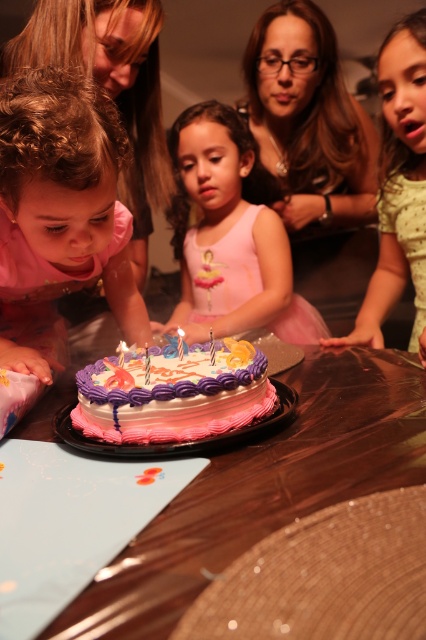
You are a photographer standing at the camera position. You want to take a photo of the birthday cake and the pink satin dress at center. Can you focus on both subjects clearly in the same shot?

The pink satin dress at center is 1.34 meters from the camera. Since the birthday cake is on the same table and likely at a similar distance, both subjects are at approximately the same distance from the camera, so they can be in focus simultaneously in the photo.